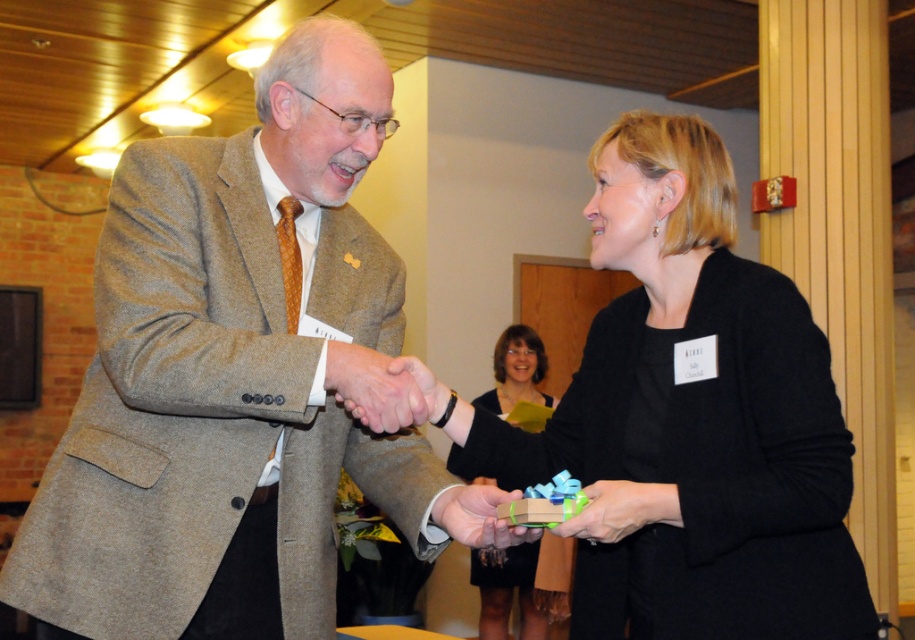
Question: Can you confirm if matte brown suit at center is bigger than black satin dress at center?

Choices:
 (A) no
 (B) yes

Answer: (B)

Question: Does matte brown hand at center appear on the right side of green matte gift box at center?

Choices:
 (A) yes
 (B) no

Answer: (B)

Question: Which of the following is the closest to the observer?

Choices:
 (A) (630, 520)
 (B) (329, 376)
 (C) (506, 492)
 (D) (100, 259)

Answer: (B)

Question: Does black matte jacket at center have a smaller size compared to matte brown hand at center?

Choices:
 (A) yes
 (B) no

Answer: (B)

Question: Considering the real-world distances, which object is closest to the matte green gift at center?

Choices:
 (A) matte brown suit at center
 (B) black satin dress at center
 (C) matte brown hand at center
 (D) black matte jacket at center

Answer: (D)

Question: Which object appears farthest from the camera in this image?

Choices:
 (A) black matte jacket at center
 (B) matte brown suit at center
 (C) green matte gift box at center

Answer: (C)